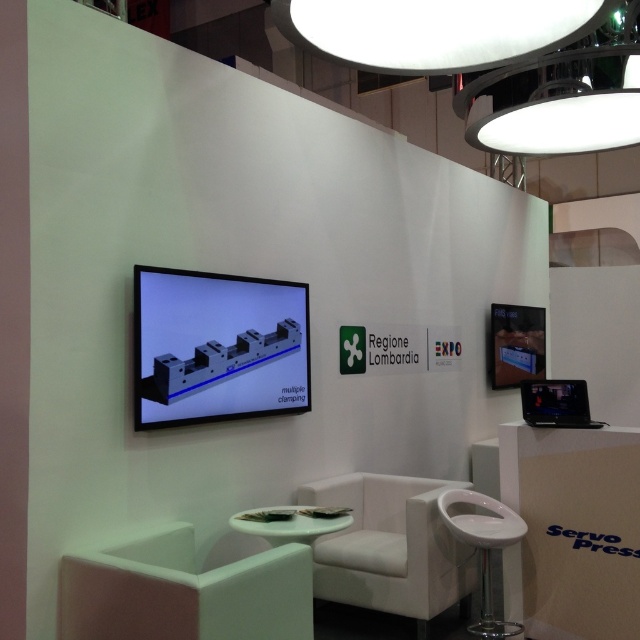
Question: Does white matte chair at lower left appear on the right side of white fabric chair at center?

Choices:
 (A) no
 (B) yes

Answer: (A)

Question: Can you confirm if white fabric chair at center is smaller than white plastic stool at lower right?

Choices:
 (A) yes
 (B) no

Answer: (B)

Question: Estimate the real-world distances between objects in this image. Which object is closer to the white fabric chair at center?

Choices:
 (A) white plastic stool at lower right
 (B) white matte chair at lower left

Answer: (A)

Question: Among these points, which one is farthest from the camera?

Choices:
 (A) (108, 630)
 (B) (516, 531)
 (C) (346, 582)

Answer: (C)

Question: Can you confirm if white fabric chair at center is bigger than white plastic stool at lower right?

Choices:
 (A) no
 (B) yes

Answer: (B)

Question: Which of the following is the closest to the observer?

Choices:
 (A) white matte chair at lower left
 (B) white fabric chair at center

Answer: (A)